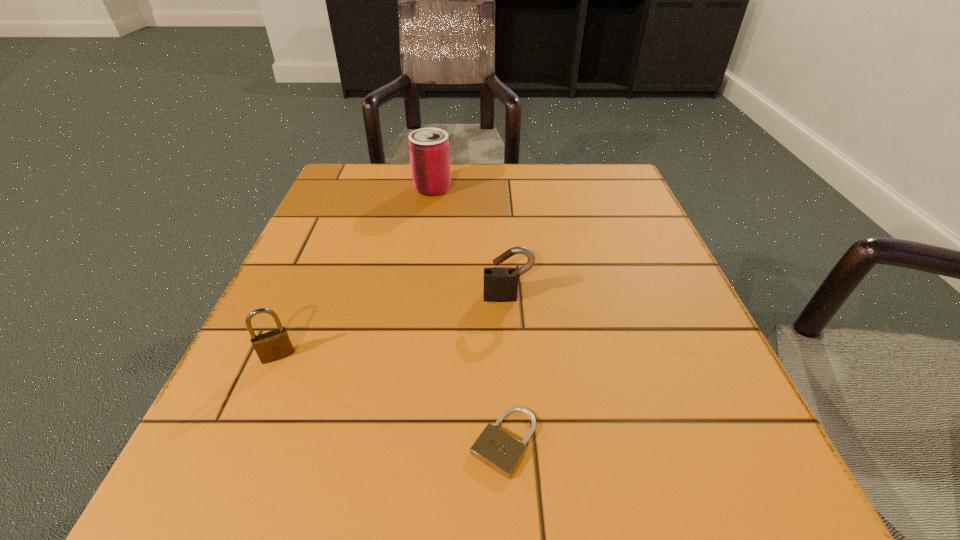
At what (x,y) coordinates should I click in order to perform the action: click on vacant space at the far right corner of the desktop. Please return your answer as a coordinate pair (x, y). The height and width of the screenshot is (540, 960). Looking at the image, I should click on (627, 192).

You are a GUI agent. You are given a task and a screenshot of the screen. Output one action in this format:
    pyautogui.click(x=<x>, y=<y>)
    Task: Click on the free space at the near right corner
    
    Given the screenshot: What is the action you would take?
    pyautogui.click(x=708, y=500)

The height and width of the screenshot is (540, 960). I want to click on free space that is in between the farthest object and the nearest object, so click(x=468, y=315).

You are a GUI agent. You are given a task and a screenshot of the screen. Output one action in this format:
    pyautogui.click(x=<x>, y=<y>)
    Task: Click on the vacant area that lies between the farthest padlock and the second object from left to right
    This screenshot has width=960, height=540.
    Given the screenshot: What is the action you would take?
    pyautogui.click(x=470, y=243)

Identify the location of empty space that is in between the nearest object and the farthest padlock. The image size is (960, 540). (506, 369).

You are a GUI agent. You are given a task and a screenshot of the screen. Output one action in this format:
    pyautogui.click(x=<x>, y=<y>)
    Task: Click on the vacant space in between the second farthest object and the tallest object
    
    Given the screenshot: What is the action you would take?
    pyautogui.click(x=470, y=243)

At what (x,y) coordinates should I click in order to perform the action: click on vacant area that lies between the nearest padlock and the can. Please return your answer as a coordinate pair (x, y). This screenshot has width=960, height=540. Looking at the image, I should click on (468, 315).

Locate an element on the screen. This screenshot has width=960, height=540. vacant space in between the shortest object and the third object from right to left is located at coordinates (468, 315).

Locate an element on the screen. The image size is (960, 540). free space between the farthest object and the shortest object is located at coordinates (468, 315).

At what (x,y) coordinates should I click in order to perform the action: click on vacant area that lies between the farthest padlock and the nearest padlock. Please return your answer as a coordinate pair (x, y). Looking at the image, I should click on (506, 369).